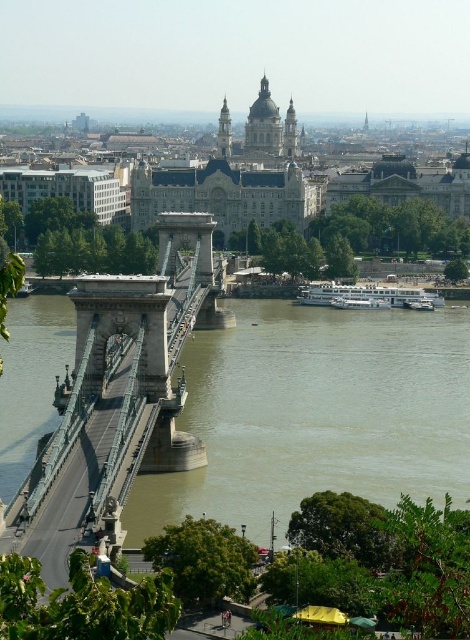
Who is more forward, (234,522) or (106,310)?

Point (234,522)

Does green stone bridge at center have a lesser height compared to green metallic suspension bridge at center?

Correct, green stone bridge at center is not as tall as green metallic suspension bridge at center.

Is point (63, 301) farther from camera compared to point (39, 529)?

That is True.

This screenshot has height=640, width=470. I want to click on green stone bridge at center, so click(x=316, y=413).

Based on the photo, can you confirm if green stone bridge at center is positioned to the left of golden stone tower at upper center?

In fact, green stone bridge at center is to the right of golden stone tower at upper center.

Which is behind, point (381, 394) or point (284, 124)?

The point (284, 124) is behind.

Locate an element on the screen. This screenshot has height=640, width=470. green stone bridge at center is located at coordinates (316, 413).

Between green metallic suspension bridge at center and golden stone tower at upper center, which one is positioned higher?

golden stone tower at upper center

Image resolution: width=470 pixels, height=640 pixels. What are the coordinates of `green metallic suspension bridge at center` in the screenshot? It's located at (118, 397).

This screenshot has width=470, height=640. Identify the location of green metallic suspension bridge at center. (118, 397).